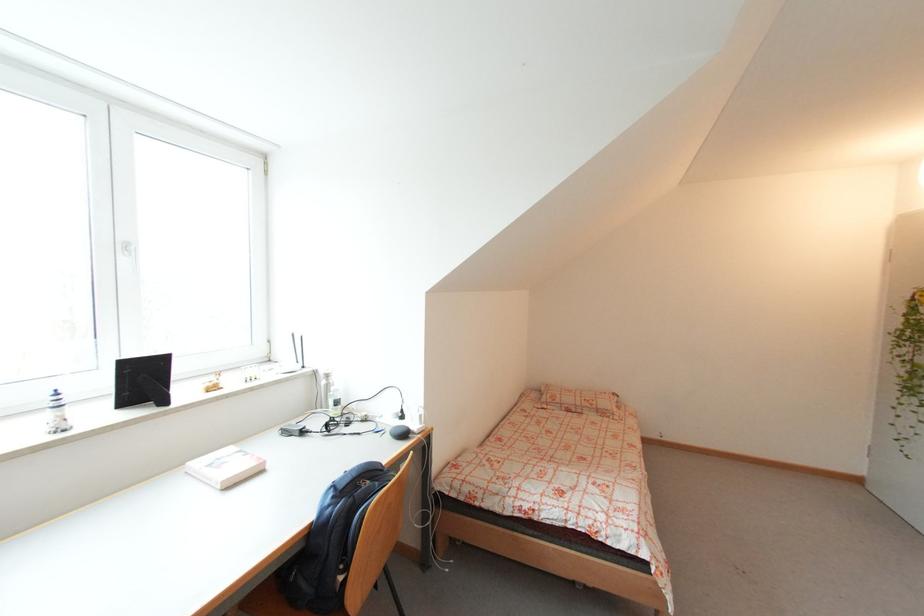
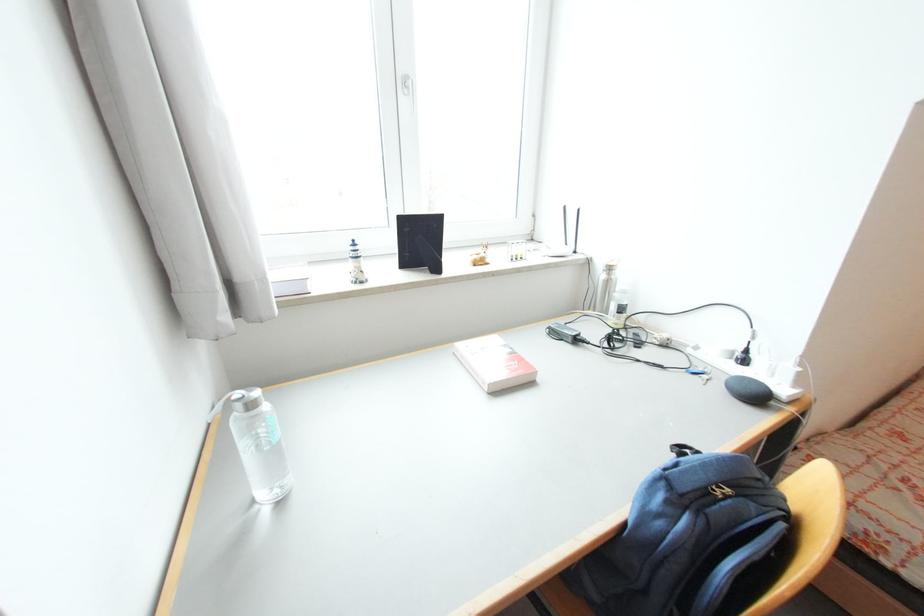
Where in the second image is the point corresponding to the point at 337,389 from the first image?

(623, 288)